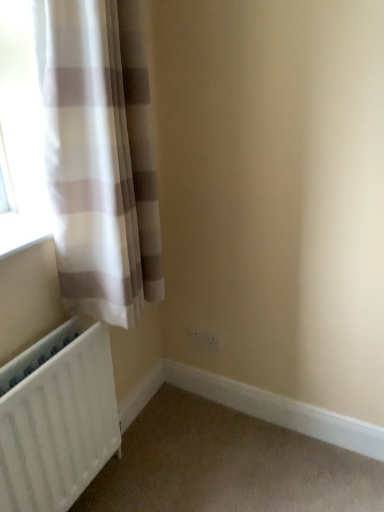
Describe the element at coordinates (100, 156) in the screenshot. I see `white sheer curtain at left` at that location.

You are a GUI agent. You are given a task and a screenshot of the screen. Output one action in this format:
    pyautogui.click(x=<x>, y=<y>)
    Task: Click on the white plastic electric outlet at lower center
    This screenshot has width=384, height=512.
    Given the screenshot: What is the action you would take?
    pyautogui.click(x=205, y=339)

Where is `white sheer curtain at left`? Image resolution: width=384 pixels, height=512 pixels. white sheer curtain at left is located at coordinates (100, 156).

From the picture: Considering the positions of objects white plastic electric outlet at lower center and white sheer curtain at left in the image provided, who is more to the left, white plastic electric outlet at lower center or white sheer curtain at left?

From the viewer's perspective, white sheer curtain at left appears more on the left side.

Locate an element on the screen. electric outlet below the white sheer curtain at left (from the image's perspective) is located at coordinates (205, 339).

From the image's perspective, is white plastic electric outlet at lower center located above white sheer curtain at left?

No.

Can white sheer curtain at left be found inside white plastic electric outlet at lower center?

No, white sheer curtain at left is located outside of white plastic electric outlet at lower center.

Is white plastic electric outlet at lower center smaller than white matte radiator at lower left?

Correct, white plastic electric outlet at lower center occupies less space than white matte radiator at lower left.

From a real-world perspective, is white plastic electric outlet at lower center physically below white matte radiator at lower left?

Indeed, from a real-world perspective, white plastic electric outlet at lower center is positioned beneath white matte radiator at lower left.

How different are the orientations of white matte radiator at lower left and white sheer curtain at left in degrees?

white matte radiator at lower left and white sheer curtain at left are facing 0.00207 degrees away from each other.

Would you say white matte radiator at lower left is outside white sheer curtain at left?

white matte radiator at lower left is positioned outside white sheer curtain at left.

Is the depth of white matte radiator at lower left greater than that of white sheer curtain at left?

Yes, white matte radiator at lower left is further from the camera.

Does white sheer curtain at left have a larger size compared to white matte radiator at lower left?

Indeed, white sheer curtain at left has a larger size compared to white matte radiator at lower left.

Can you see white sheer curtain at left touching white matte radiator at lower left?

white sheer curtain at left is not next to white matte radiator at lower left, and they're not touching.

Is white sheer curtain at left facing towards white matte radiator at lower left?

No, white sheer curtain at left is not turned towards white matte radiator at lower left.

From a real-world perspective, does white sheer curtain at left stand above white matte radiator at lower left?

Indeed, from a real-world perspective, white sheer curtain at left stands above white matte radiator at lower left.

Looking at their sizes, would you say white sheer curtain at left is wider or thinner than white plastic electric outlet at lower center?

In the image, white sheer curtain at left appears to be wider than white plastic electric outlet at lower center.

Which object is positioned more to the left, white sheer curtain at left or white plastic electric outlet at lower center?

white sheer curtain at left.

Is white sheer curtain at left far away from white plastic electric outlet at lower center?

No, there isn't a large distance between white sheer curtain at left and white plastic electric outlet at lower center.

Who is shorter, white sheer curtain at left or white plastic electric outlet at lower center?

With less height is white plastic electric outlet at lower center.

Which is behind, white matte radiator at lower left or white plastic electric outlet at lower center?

white plastic electric outlet at lower center is more distant.

From the image's perspective, is white matte radiator at lower left positioned above or below white plastic electric outlet at lower center?

Based on their image positions, white matte radiator at lower left is located beneath white plastic electric outlet at lower center.

Consider the image. Would you say white matte radiator at lower left is outside white plastic electric outlet at lower center?

white matte radiator at lower left lies outside white plastic electric outlet at lower center's area.

Looking at their sizes, would you say white matte radiator at lower left is wider or thinner than white plastic electric outlet at lower center?

Clearly, white matte radiator at lower left has more width compared to white plastic electric outlet at lower center.

At what (x,y) coordinates should I click in order to perform the action: click on electric outlet behind the white sheer curtain at left. Please return your answer as a coordinate pair (x, y). Looking at the image, I should click on (205, 339).

Find the location of `electric outlet above the white matte radiator at lower left (from the image's perspective)`. electric outlet above the white matte radiator at lower left (from the image's perspective) is located at coordinates (205, 339).

Looking at the image, which one is located closer to white plastic electric outlet at lower center, white sheer curtain at left or white matte radiator at lower left?

white matte radiator at lower left is positioned closer to the anchor white plastic electric outlet at lower center.

When comparing their distances from white plastic electric outlet at lower center, does white matte radiator at lower left or white sheer curtain at left seem further?

white sheer curtain at left is further to white plastic electric outlet at lower center.

Which object lies further to the anchor point white sheer curtain at left, white plastic electric outlet at lower center or white matte radiator at lower left?

Based on the image, white plastic electric outlet at lower center appears to be further to white sheer curtain at left.

Consider the image. Which object lies nearer to the anchor point white matte radiator at lower left, white sheer curtain at left or white plastic electric outlet at lower center?

The object closer to white matte radiator at lower left is white sheer curtain at left.

Based on the photo, estimate the real-world distances between objects in this image. Which object is further from white sheer curtain at left, white matte radiator at lower left or white plastic electric outlet at lower center?

Based on the image, white plastic electric outlet at lower center appears to be further to white sheer curtain at left.

Estimate the real-world distances between objects in this image. Which object is further from white matte radiator at lower left, white plastic electric outlet at lower center or white sheer curtain at left?

The object further to white matte radiator at lower left is white plastic electric outlet at lower center.

The height and width of the screenshot is (512, 384). I want to click on radiator located between white sheer curtain at left and white plastic electric outlet at lower center in the depth direction, so click(x=57, y=418).